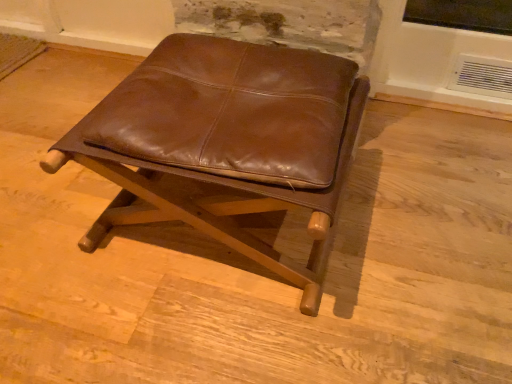
Where is `vacant point to the right of brown leather stool at center`? Image resolution: width=512 pixels, height=384 pixels. vacant point to the right of brown leather stool at center is located at coordinates (414, 214).